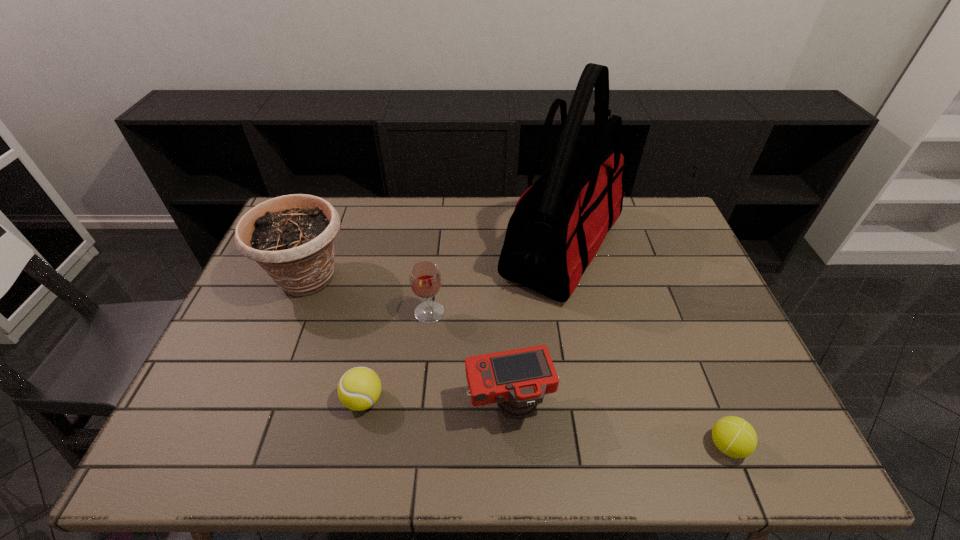
This screenshot has width=960, height=540. Identify the location of vacant position located on the right of the flowerpot. (370, 279).

Identify the location of free space located 0.300m on the right of the wineglass. (550, 312).

This screenshot has width=960, height=540. In order to click on free location located 0.190m on the right of the camera in this screenshot , I will do `click(633, 404)`.

At what (x,y) coordinates should I click in order to perform the action: click on blank space located on the right of the left tennis ball. Please return your answer as a coordinate pair (x, y). This screenshot has height=540, width=960. Looking at the image, I should click on (439, 400).

At what (x,y) coordinates should I click in order to perform the action: click on vacant space situated on the back of the nearer tennis ball. Please return your answer as a coordinate pair (x, y). Looking at the image, I should click on (678, 325).

This screenshot has width=960, height=540. In order to click on object at the far edge in this screenshot , I will do `click(559, 223)`.

Where is `camera that is positioned at the near edge`? The width and height of the screenshot is (960, 540). camera that is positioned at the near edge is located at coordinates 517,380.

Where is `tennis ball that is at the near edge`? The image size is (960, 540). tennis ball that is at the near edge is located at coordinates (733, 436).

Find the location of `object that is positioned at the left edge`. object that is positioned at the left edge is located at coordinates (292, 237).

You are a GUI agent. You are given a task and a screenshot of the screen. Output one action in this format:
    pyautogui.click(x=<x>, y=<y>)
    Task: Click on the object that is at the right edge
    Image resolution: width=960 pixels, height=540 pixels.
    Given the screenshot: What is the action you would take?
    pyautogui.click(x=733, y=436)